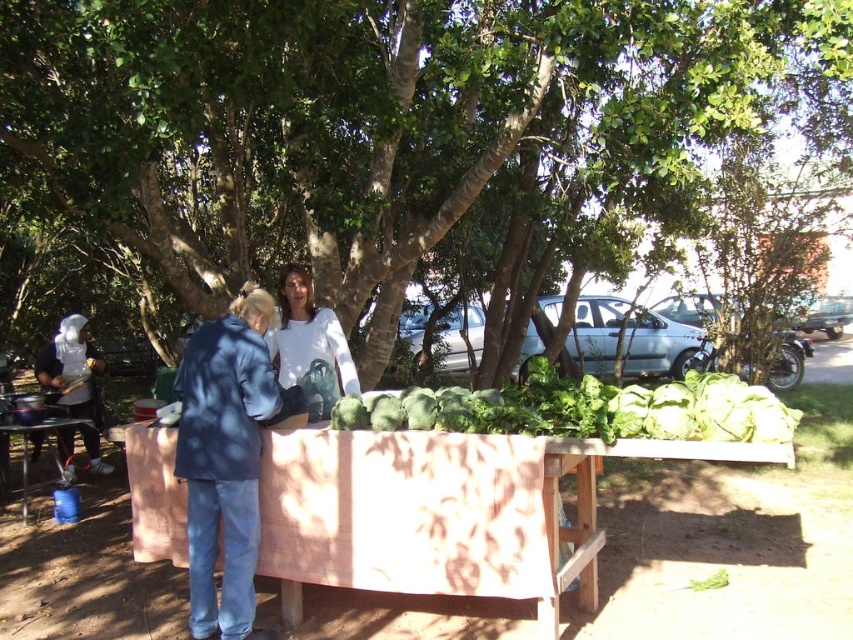
You are standing at the point labeled as point (225, 458) in the image. What object is this point located on?

The point (225, 458) is located on the blue denim jacket at lower left.

You are standing at the wooden table covered with a pink cloth in the market scene. You see two points marked in the image. Which point is closer to you, point (312, 120) or point (143, 433)?

Point (312, 120) is further to the viewer than point (143, 433), so the closer point to you is point (143, 433).